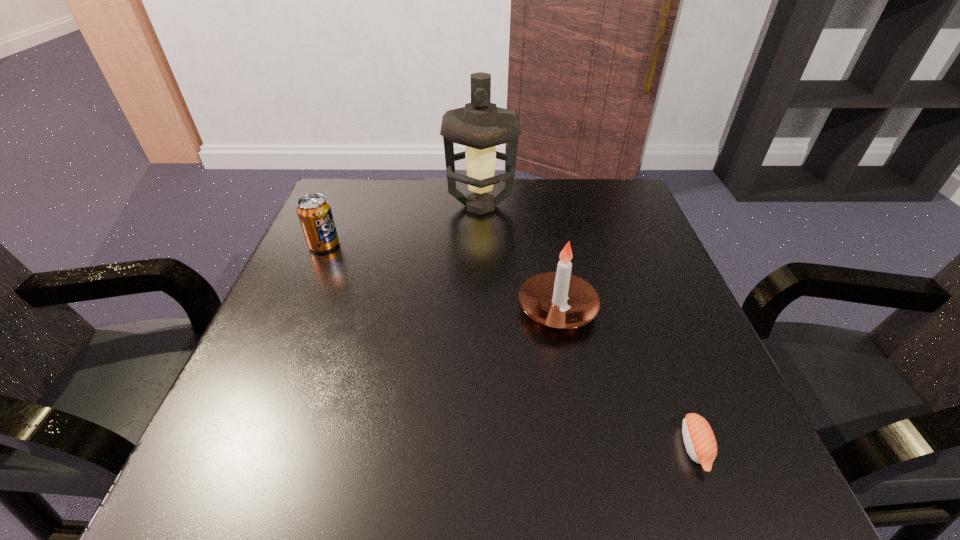
Locate an element on the screen. empty space that is in between the rightmost object and the second nearest object is located at coordinates (626, 378).

Where is `free area in between the nearest object and the farthest object`? The height and width of the screenshot is (540, 960). free area in between the nearest object and the farthest object is located at coordinates (588, 326).

Locate an element on the screen. vacant area between the tallest object and the third farthest object is located at coordinates (519, 258).

You are a GUI agent. You are given a task and a screenshot of the screen. Output one action in this format:
    pyautogui.click(x=<x>, y=<y>)
    Task: Click on the object identified as the third closest to the oil lamp
    The height and width of the screenshot is (540, 960).
    Given the screenshot: What is the action you would take?
    pyautogui.click(x=699, y=439)

Where is `object that ranks as the third closest to the soda can`? object that ranks as the third closest to the soda can is located at coordinates (699, 439).

Locate an element on the screen. vacant region that satisfies the following two spatial constraints: 1. on the front side of the leftmost object; 2. on the right side of the second nearest object is located at coordinates (297, 309).

The width and height of the screenshot is (960, 540). I want to click on free spot that satisfies the following two spatial constraints: 1. on the front side of the third nearest object; 2. on the right side of the nearest object, so click(238, 447).

Find the location of a particular element. free space that satisfies the following two spatial constraints: 1. on the front side of the candle; 2. on the left side of the oil lamp is located at coordinates (481, 309).